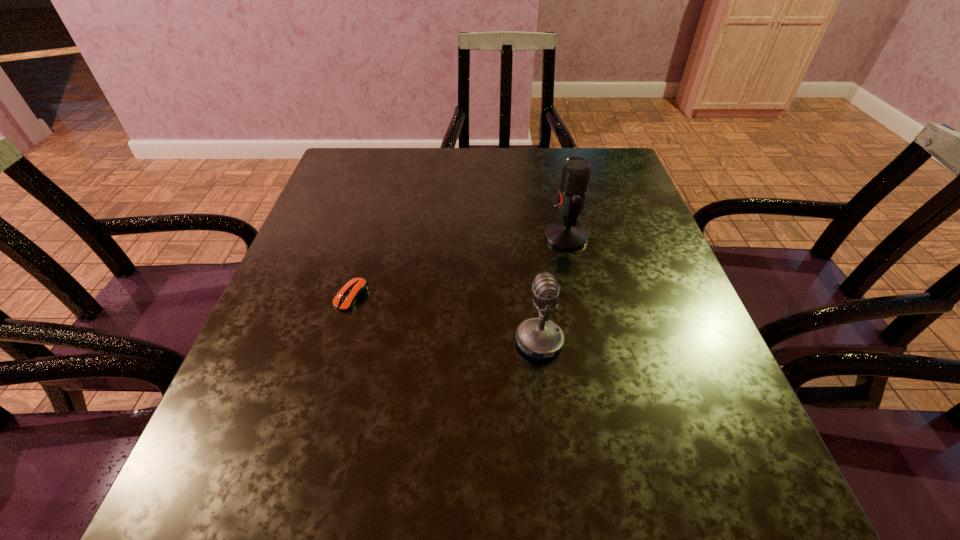
Locate an element on the screen. The image size is (960, 540). the farther microphone is located at coordinates (568, 235).

Where is `the shorter microphone`? This screenshot has height=540, width=960. the shorter microphone is located at coordinates point(539,338).

Locate an element on the screen. This screenshot has width=960, height=540. the second shortest object is located at coordinates (539, 338).

You are a GUI agent. You are given a task and a screenshot of the screen. Output one action in this format:
    pyautogui.click(x=<x>, y=<y>)
    Task: Click on the computer mouse
    This screenshot has width=960, height=540.
    Given the screenshot: What is the action you would take?
    pyautogui.click(x=356, y=288)

The image size is (960, 540). I want to click on the second farthest object, so click(x=356, y=288).

The height and width of the screenshot is (540, 960). Identify the location of free spot located on the side of the farthest object with the red ring. (418, 237).

The image size is (960, 540). Identify the location of blank space located on the side of the farthest object with the red ring. (457, 237).

At what (x,y) coordinates should I click in order to perform the action: click on free space located on the side of the farthest object with the red ring. Please return your answer as a coordinate pair (x, y). The height and width of the screenshot is (540, 960). Looking at the image, I should click on (373, 237).

You are a GUI agent. You are given a task and a screenshot of the screen. Output one action in this format:
    pyautogui.click(x=<x>, y=<y>)
    Task: Click on the free point located 0.350m on the front-facing side of the nearer microphone
    This screenshot has height=540, width=960.
    Given the screenshot: What is the action you would take?
    pyautogui.click(x=321, y=342)

Where is `vacant region located on the front-facing side of the nearer microphone`? The image size is (960, 540). vacant region located on the front-facing side of the nearer microphone is located at coordinates (444, 342).